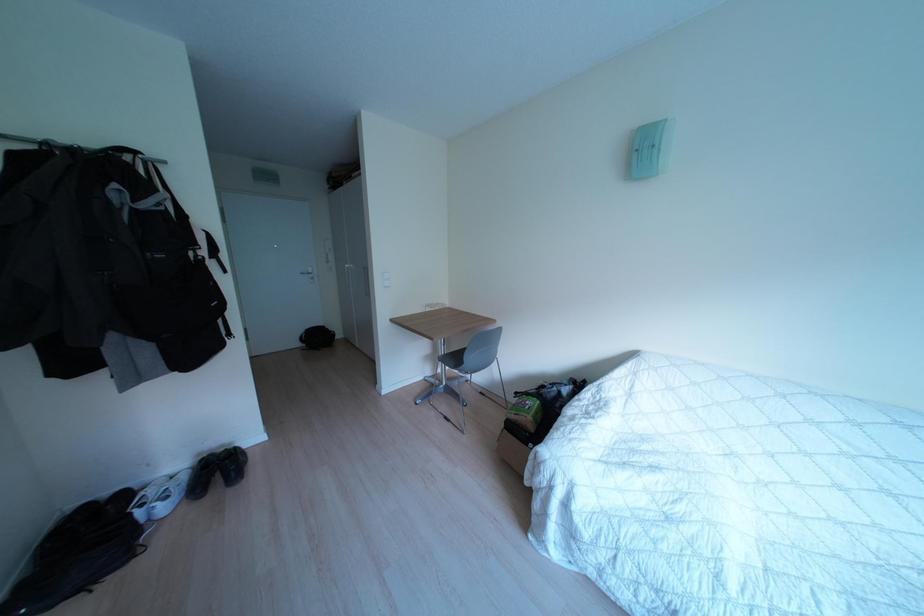
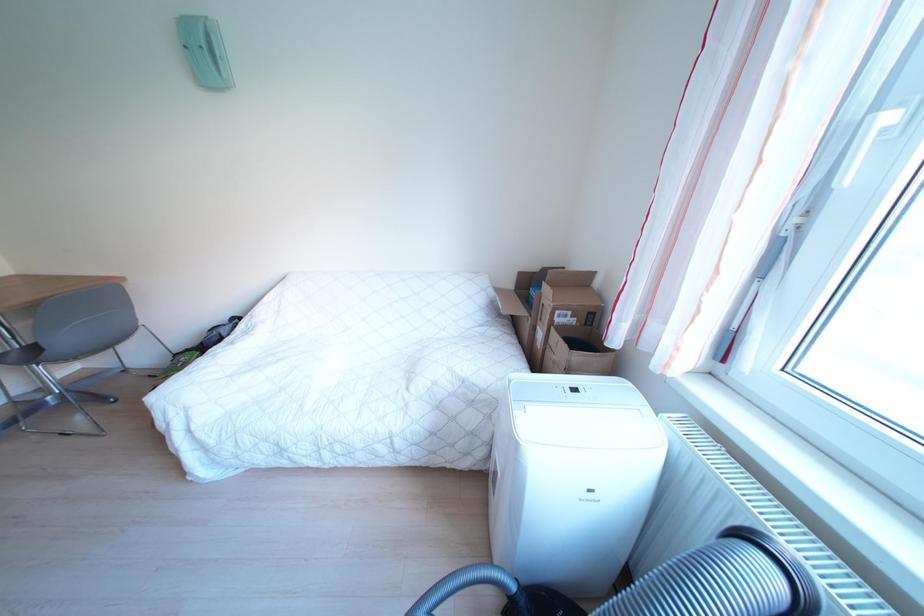
The images are taken continuously from a first-person perspective. In which direction is your viewpoint rotating?

The camera's rotation is toward right-down.